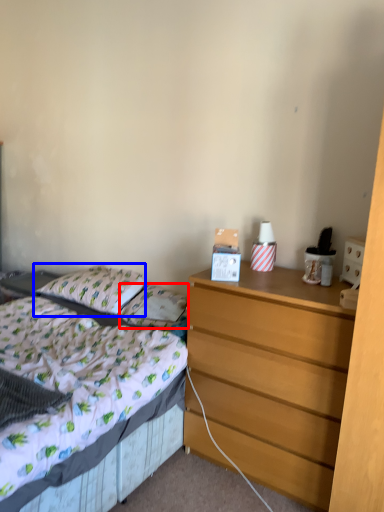
Question: Which object is further to the camera taking this photo, pillow (highlighted by a red box) or pillow (highlighted by a blue box)?

Choices:
 (A) pillow
 (B) pillow

Answer: (B)